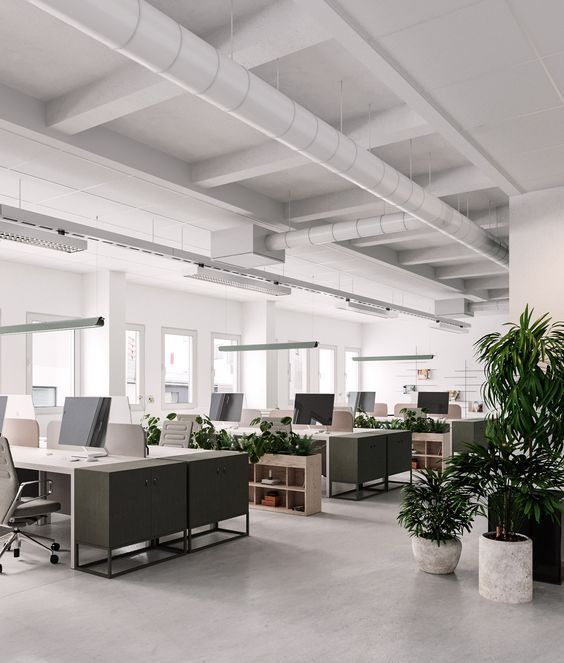
Locate an element on the screen. This screenshot has width=564, height=663. desk chairs is located at coordinates (174, 422), (195, 420), (7, 465), (267, 410).